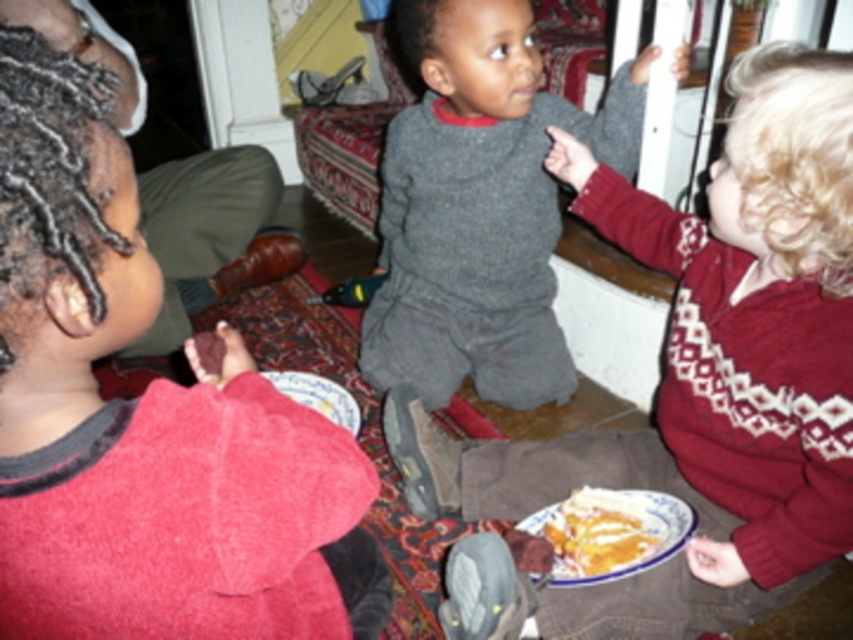
You are a parent trying to ensure your children are seated properly during mealtime. You see the gray sweater at center and the white ceramic plate at lower center. Which object is positioned closer to you?

The gray sweater at center is closer to the viewer than the white ceramic plate at lower center, so the gray sweater at center is positioned closer to you.

You are a parent trying to ensure your children don not spill their food. You have a small plate that can only hold items narrower than the red fleece sweater at left. Can the yellowish matte pie at lower center fit on the plate?

The red fleece sweater at left is wider than the yellowish matte pie at lower center. Since the plate can only hold items narrower than the sweater, the yellowish matte pie at lower center can fit on the plate because it is narrower than the sweater.

You are a parent trying to ensure your children are sitting properly during mealtime. You notice the red fleece sweater at left and the yellowish matte pie at lower center. Which object is taller?

The red fleece sweater at left is taller than the yellowish matte pie at lower center.